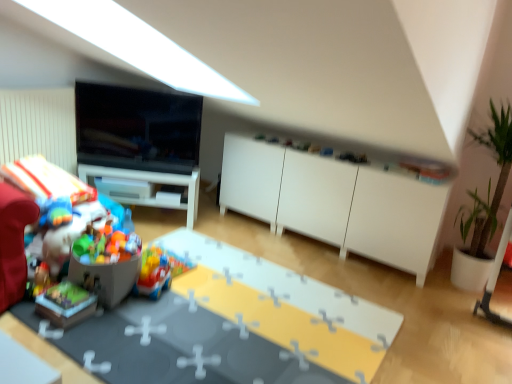
The image size is (512, 384). I want to click on vacant area located to the right-hand side of white glossy desk at center, so click(x=217, y=224).